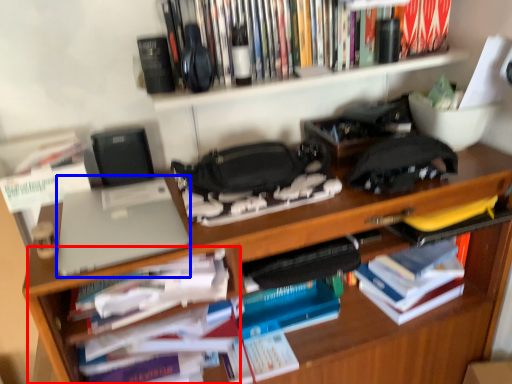
Question: Which point is closer to the camera, cabinet (highlighted by a red box) or laptop (highlighted by a blue box)?

Choices:
 (A) cabinet
 (B) laptop

Answer: (B)